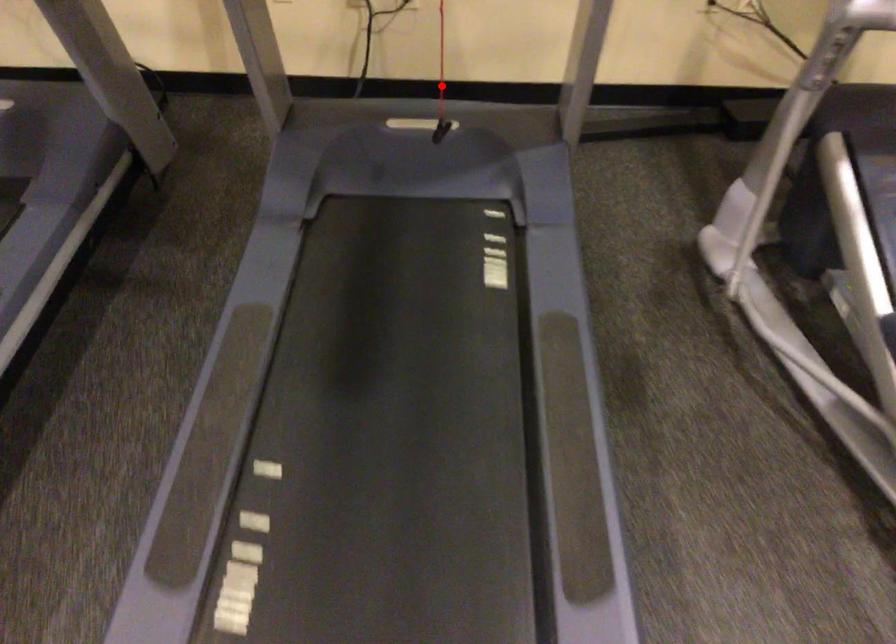
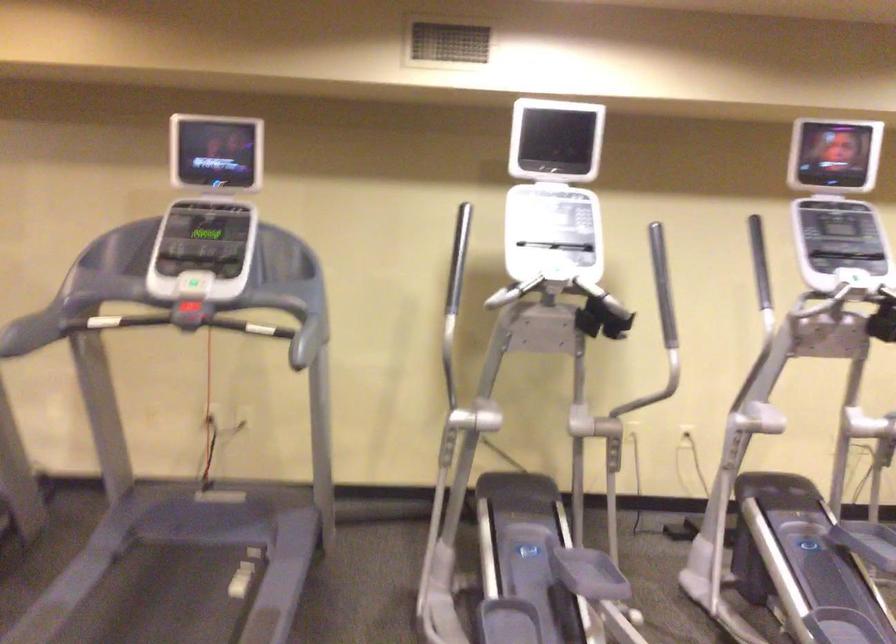
Question: I am providing you with two images of the same scene from different viewpoints. A red point is marked on the first image. At the location where the point appears in image 1, is it still visible in image 2?

Choices:
 (A) Yes
 (B) No

Answer: (B)